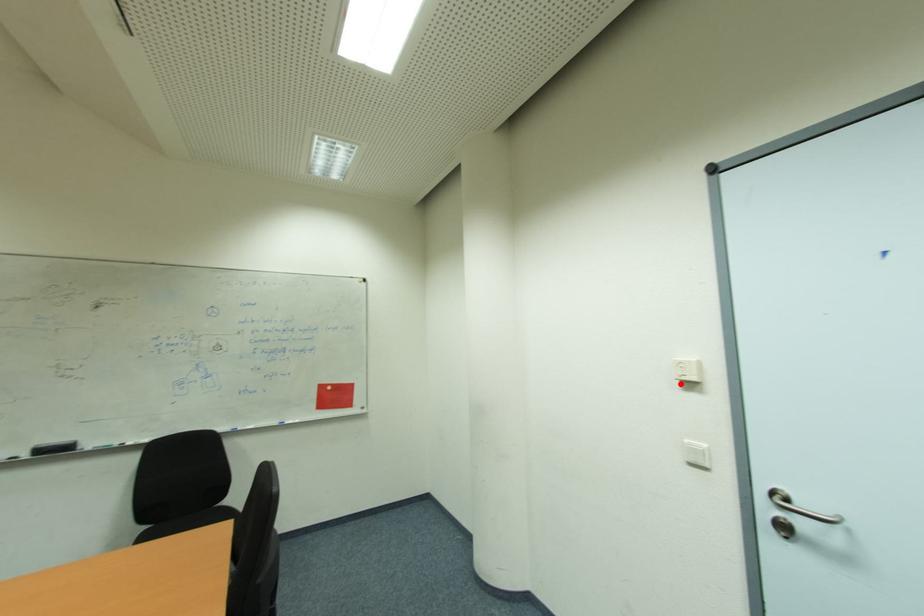
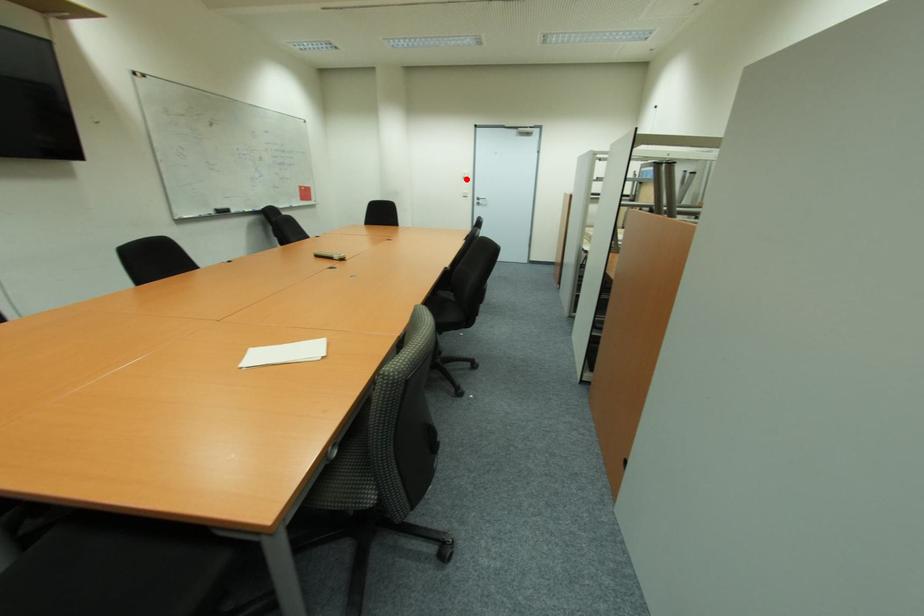
I am providing you with two images of the same scene from different viewpoints. A red point is marked on the first image and another point is marked on the second image. Do the highlighted points in image1 and image2 indicate the same real-world spot?

Yes